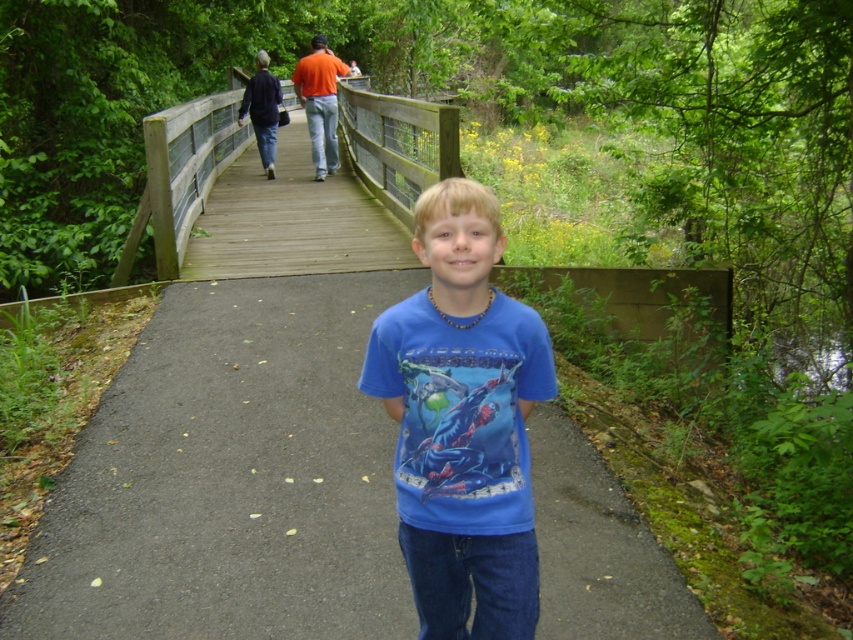
Is blue cotton shirt at center to the right of wooden bridge at upper center from the viewer's perspective?

Yes, blue cotton shirt at center is to the right of wooden bridge at upper center.

Does blue cotton shirt at center have a lesser height compared to wooden bridge at upper center?

Yes, blue cotton shirt at center is shorter than wooden bridge at upper center.

Where is `blue cotton shirt at center`? blue cotton shirt at center is located at coordinates (462, 422).

The width and height of the screenshot is (853, 640). I want to click on blue cotton shirt at center, so click(462, 422).

Which is more to the right, blue t-shirt at center or wooden bridge at upper center?

blue t-shirt at center is more to the right.

Which of these two, blue t-shirt at center or wooden bridge at upper center, stands taller?

wooden bridge at upper center is taller.

Locate an element on the screen. blue t-shirt at center is located at coordinates (230, 477).

Does blue t-shirt at center have a greater width compared to blue cotton shirt at center?

Indeed, blue t-shirt at center has a greater width compared to blue cotton shirt at center.

Who is more distant from viewer, (222,413) or (492,195)?

The point (222,413) is behind.

Locate an element on the screen. The image size is (853, 640). blue t-shirt at center is located at coordinates (230, 477).